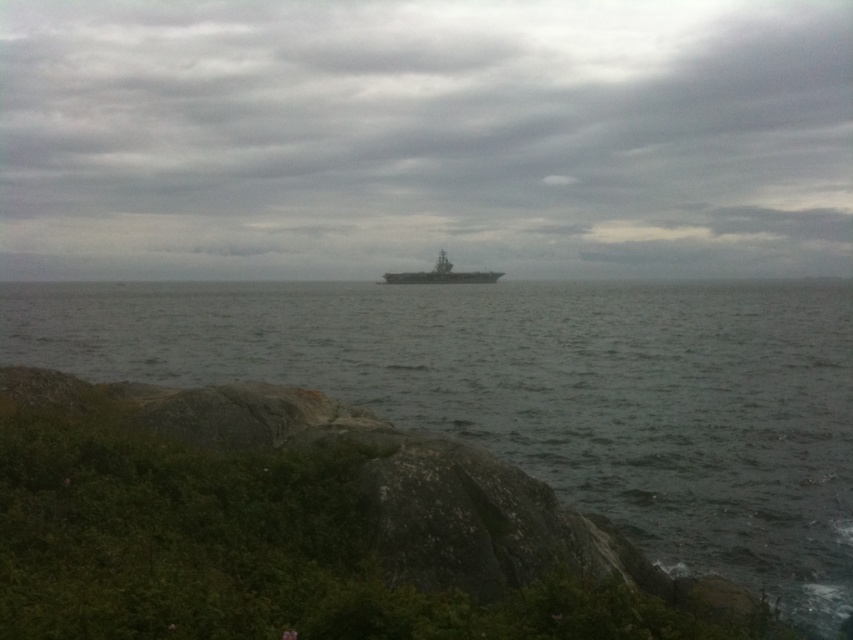
You are standing at the point with coordinates point (467,275) and want to walk towards the ocean. Is the point point (668,346) blocking your path?

Point (668,346) is in front of point (467,275), so yes, the point point (668,346) is blocking your path.

Based on the photo, you are standing at the edge of the rocky terrain in the coastal scene. There is a gray matte water at center located at point (543,392). If you want to walk towards the gray matte water at center, in which direction should you move from your current position?

The gray matte water at center is located at point (543,392), so you should move towards the center of the image to reach it.